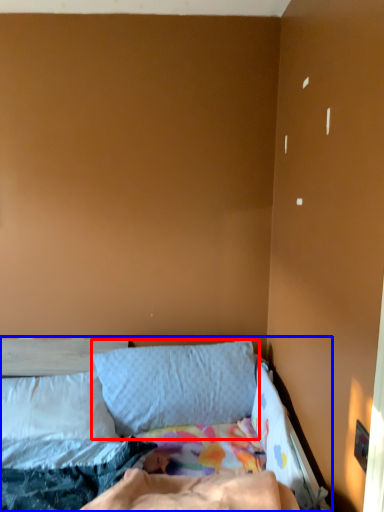
Question: Which point is further to the camera, pillow (highlighted by a red box) or bed (highlighted by a blue box)?

Choices:
 (A) pillow
 (B) bed

Answer: (A)